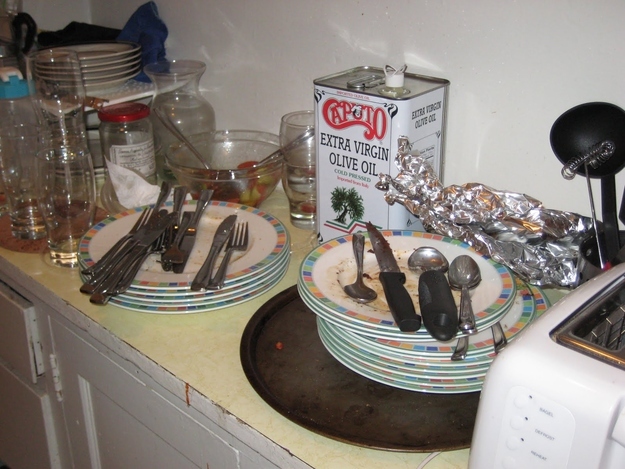
Locate an element on the screen. This screenshot has height=469, width=625. toaster is located at coordinates [x=569, y=415].